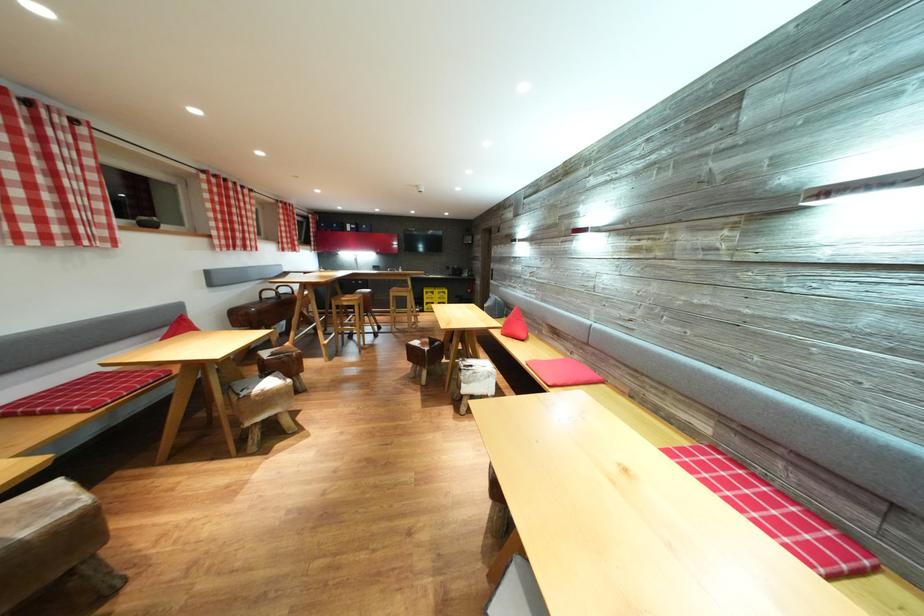
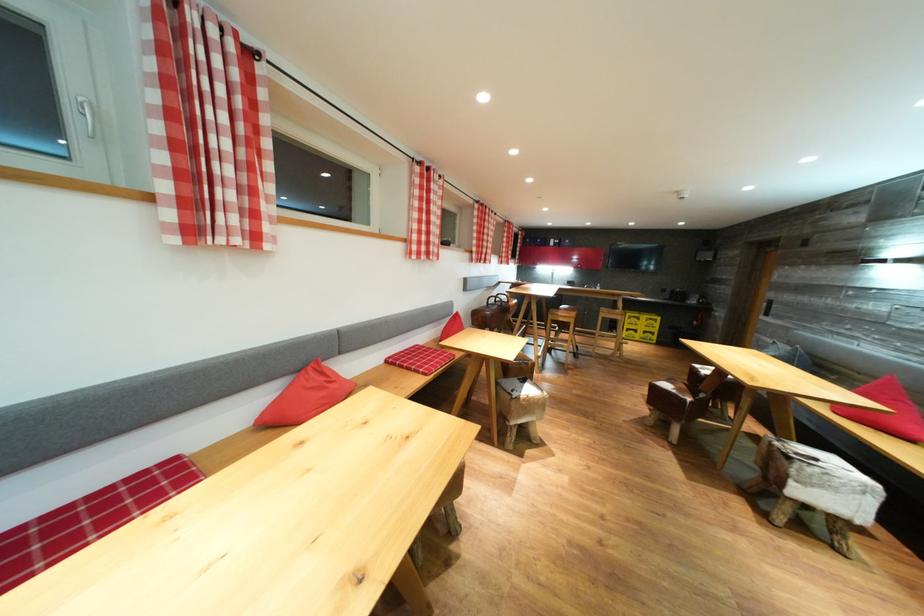
Locate, in the second image, the point that corresponds to pixel 478 371 in the first image.

(821, 464)